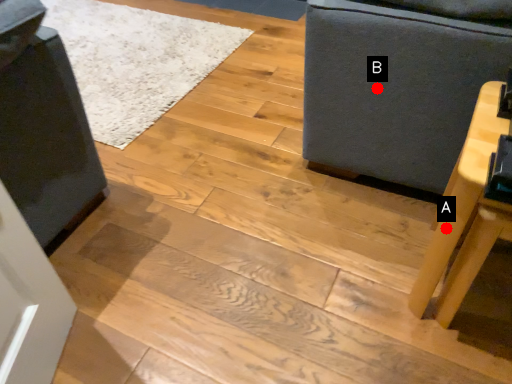
Question: Two points are circled on the image, labeled by A and B beside each circle. Which point is closer to the camera?

Choices:
 (A) A is closer
 (B) B is closer

Answer: (A)